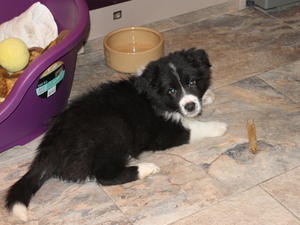
Locate an element on the screen. The image size is (300, 225). baseboard is located at coordinates (154, 8).